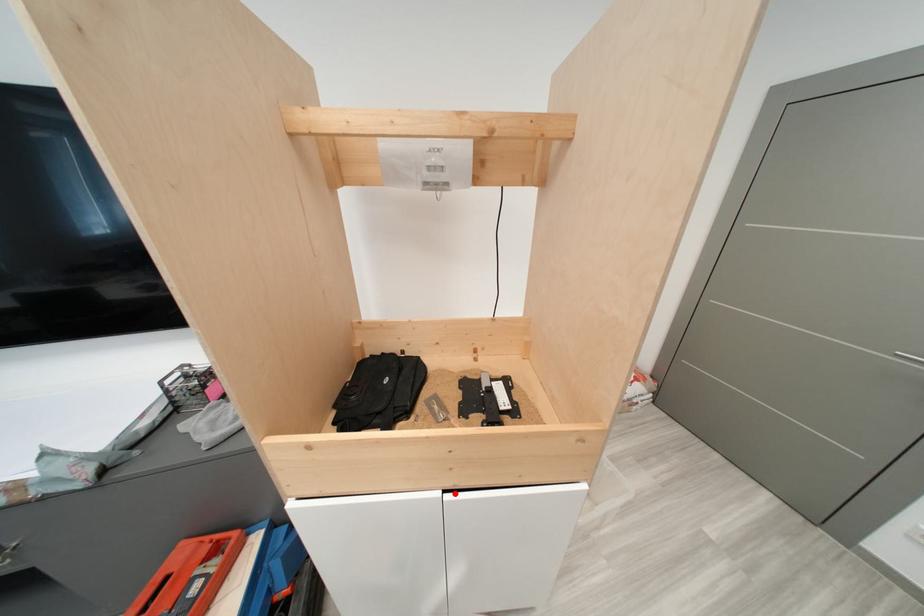
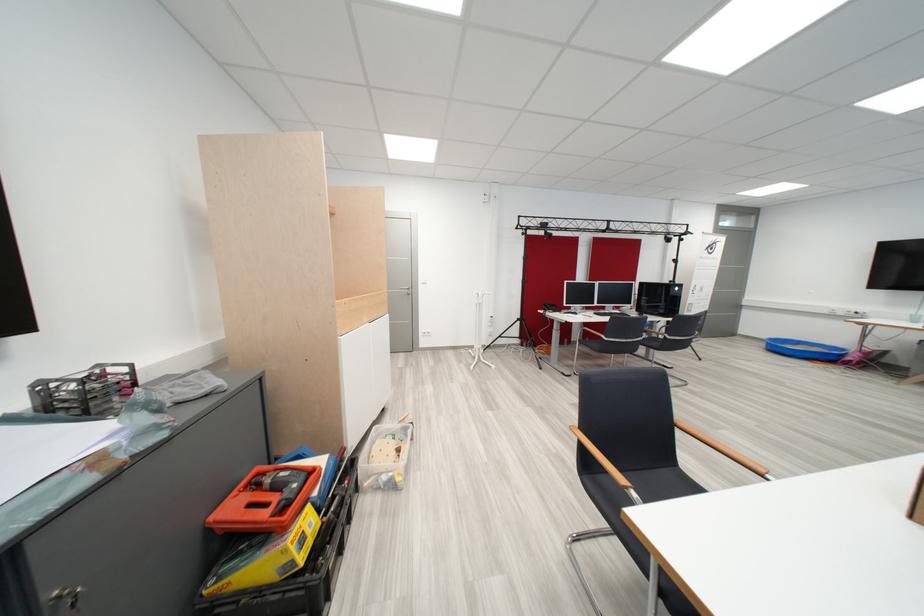
Locate, in the second image, the point that corresponds to the highlighted location in the first image.

(379, 326)